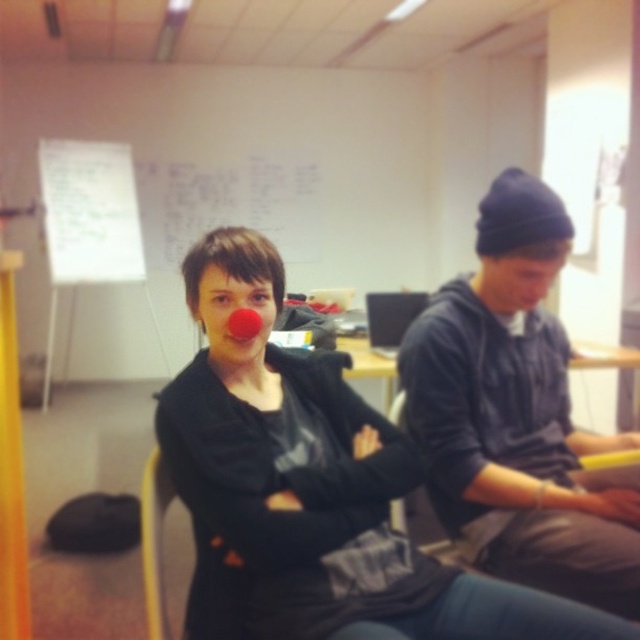
Question: In this image, where is matte red nose at center located relative to matte black beanie at upper right?

Choices:
 (A) left
 (B) right

Answer: (A)

Question: Among these points, which one is farthest from the camera?

Choices:
 (A) (228, 346)
 (B) (250, 387)

Answer: (B)

Question: Is matte red nose at center to the right of matte black beanie at upper right from the viewer's perspective?

Choices:
 (A) no
 (B) yes

Answer: (A)

Question: Does matte black sweater at center appear on the right side of matte black beanie at upper right?

Choices:
 (A) no
 (B) yes

Answer: (A)

Question: Which point is farther from the camera taking this photo?

Choices:
 (A) (323, 451)
 (B) (508, 253)
 (C) (476, 458)

Answer: (B)

Question: Estimate the real-world distances between objects in this image. Which object is farther from the matte red nose at center?

Choices:
 (A) matte black sweater at center
 (B) dark gray hoodie at center

Answer: (B)